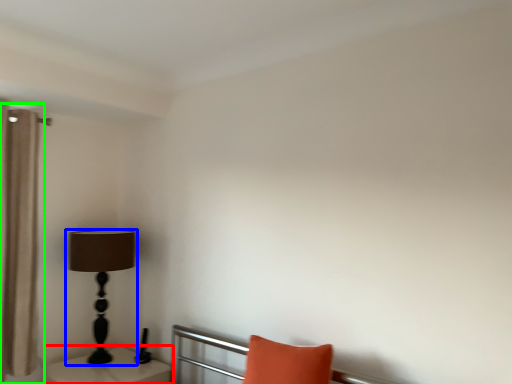
Question: Which object is the farthest from table (highlighted by a red box)? Choose among these: lamp (highlighted by a blue box) or curtain (highlighted by a green box).

Choices:
 (A) lamp
 (B) curtain

Answer: (B)